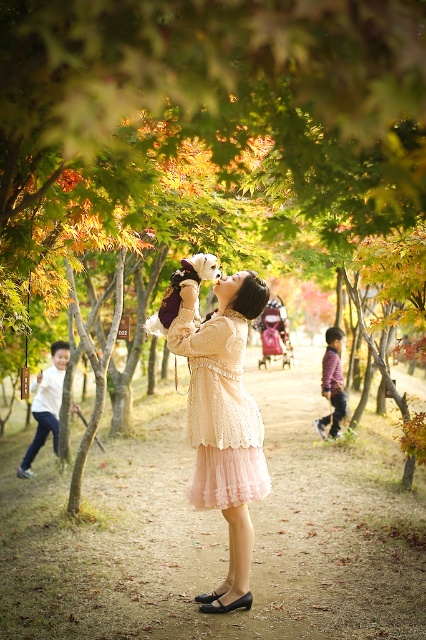
Does smooth dirt path at center have a greater width compared to white cotton shirt at left?

Indeed, smooth dirt path at center has a greater width compared to white cotton shirt at left.

Who is more forward, (x=120, y=506) or (x=57, y=390)?

Positioned in front is point (x=120, y=506).

Locate an element on the screen. smooth dirt path at center is located at coordinates (216, 531).

Locate an element on the screen. This screenshot has height=640, width=426. smooth dirt path at center is located at coordinates (216, 531).

Is lace fabric dress at center shorter than light brown fabric jacket at lower right?

Indeed, lace fabric dress at center has a lesser height compared to light brown fabric jacket at lower right.

Is lace fabric dress at center to the left of light brown fabric jacket at lower right from the viewer's perspective?

Indeed, lace fabric dress at center is positioned on the left side of light brown fabric jacket at lower right.

Which is behind, point (236, 364) or point (333, 422)?

Point (333, 422)

Image resolution: width=426 pixels, height=640 pixels. I want to click on lace fabric dress at center, so click(219, 412).

Between smooth dirt path at center and lace fabric dress at center, which one appears on the left side from the viewer's perspective?

smooth dirt path at center is more to the left.

Is smooth dirt path at center behind lace fabric dress at center?

No, smooth dirt path at center is in front of lace fabric dress at center.

The width and height of the screenshot is (426, 640). Describe the element at coordinates (216, 531) in the screenshot. I see `smooth dirt path at center` at that location.

Find the location of a particular element. Image resolution: width=426 pixels, height=640 pixels. smooth dirt path at center is located at coordinates (216, 531).